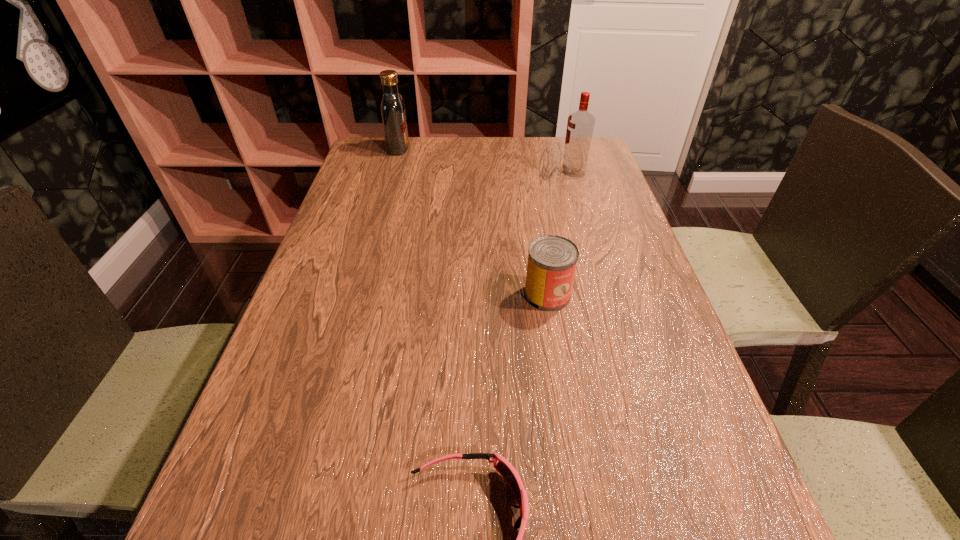
Find the location of a particular element. The height and width of the screenshot is (540, 960). vacant point located 0.260m on the front of the second shortest object is located at coordinates (569, 434).

Find the location of a particular element. object located in the left edge section of the desktop is located at coordinates (392, 107).

The image size is (960, 540). I want to click on object located in the right edge section of the desktop, so click(580, 125).

Locate an element on the screen. The height and width of the screenshot is (540, 960). object that is positioned at the far left corner is located at coordinates (392, 107).

In order to click on object located in the far right corner section of the desktop in this screenshot , I will do `click(580, 125)`.

This screenshot has width=960, height=540. In order to click on vacant space at the far edge of the desktop in this screenshot , I will do `click(462, 148)`.

In the image, there is a desktop. Where is `vacant area at the left edge`? The height and width of the screenshot is (540, 960). vacant area at the left edge is located at coordinates (362, 230).

In the image, there is a desktop. Where is `vacant space at the right edge`? vacant space at the right edge is located at coordinates (637, 245).

This screenshot has height=540, width=960. I want to click on vacant space that's between the right vodka and the second nearest object, so click(561, 234).

This screenshot has width=960, height=540. Identify the location of free spot between the can and the leftmost object. (473, 221).